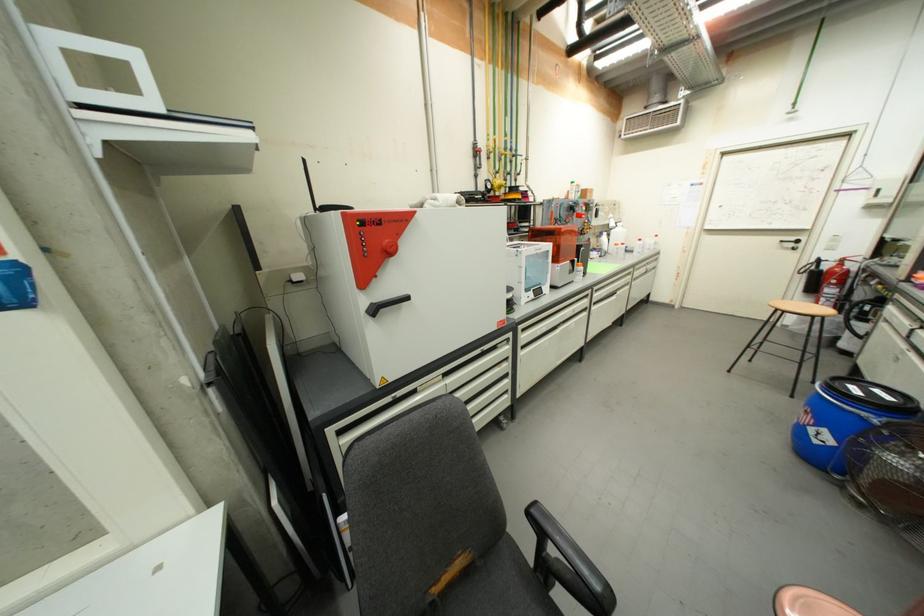
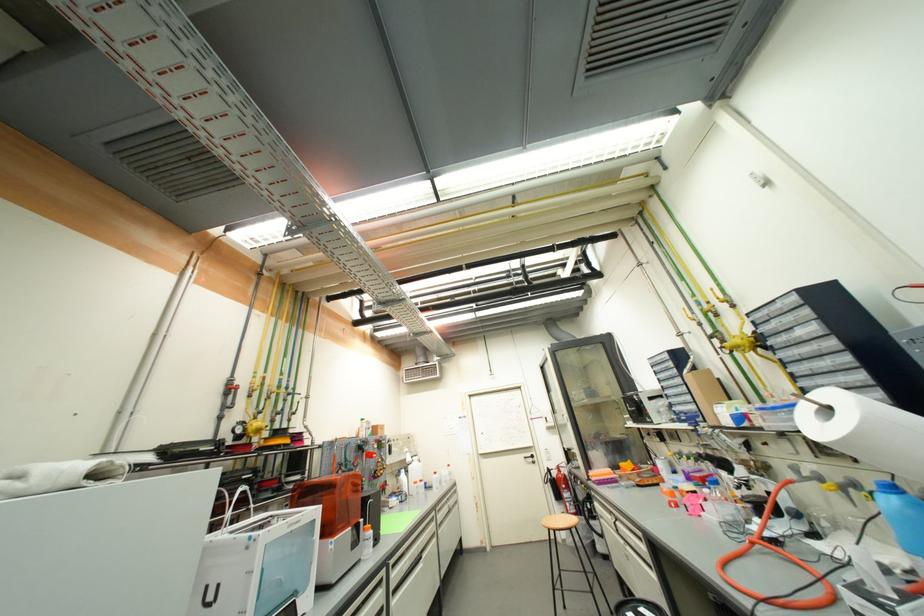
The point at (803, 363) is marked in the first image. Where is the corresponding point in the second image?

(594, 592)